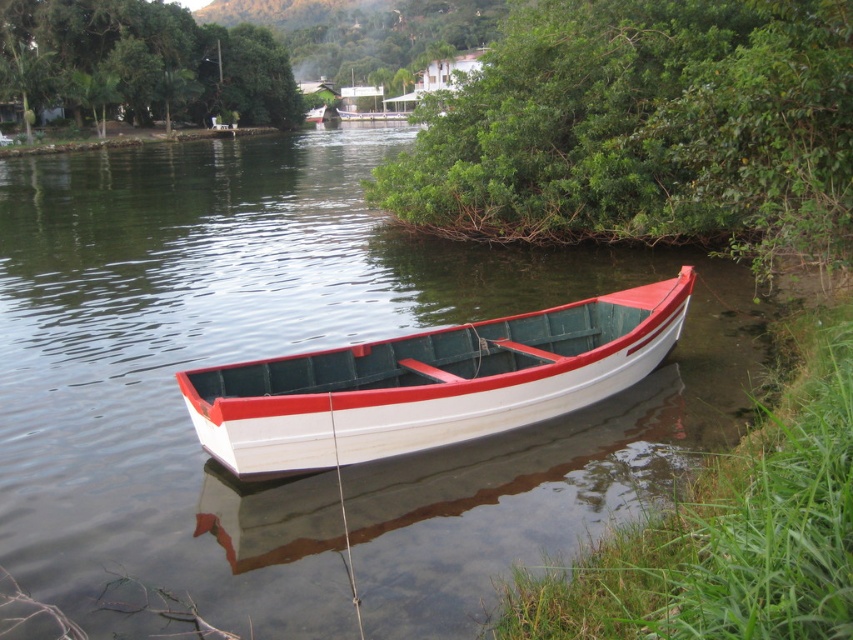
You are an observer standing on the riverside bank. You notice the green leafy bush at upper right and the white matte boat at center. Which object appears taller in the scene?

The green leafy bush at upper right is much taller than the white matte boat at center.

You are standing at the riverside and want to take a photo of the boat with the green leafy bush at upper right in the background. Based on their positions, will the bush be fully visible in the photo if you frame the boat in the center?

The green leafy bush at upper right is located at point (x=645, y=131), which means it is positioned at the upper right corner of the image. If you frame the boat in the center, the bush will likely be visible in the background but may not be fully centered. However, since it is at the upper right, part of it might be cropped depending on the camera angle and zoom. To ensure full visibility, adjust the framing to include the upper right area.